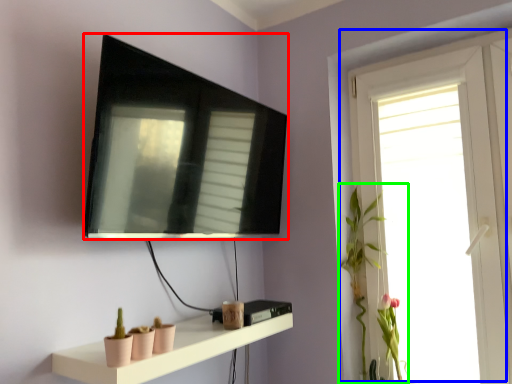
Question: Which is farther away from television (highlighted by a red box)? window (highlighted by a blue box) or plant (highlighted by a green box)?

Choices:
 (A) window
 (B) plant

Answer: (A)